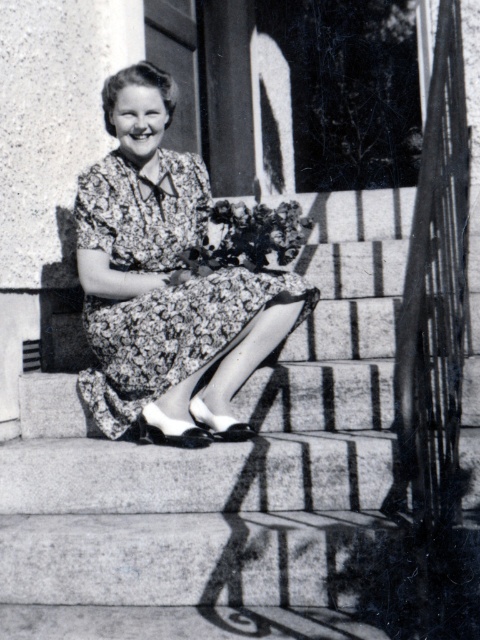
Question: Is smooth concrete stairs at center to the left of floral dress at center from the viewer's perspective?

Choices:
 (A) yes
 (B) no

Answer: (B)

Question: Does smooth concrete stairs at center appear over floral dress at center?

Choices:
 (A) yes
 (B) no

Answer: (B)

Question: Can you confirm if smooth concrete stairs at center is positioned below floral dress at center?

Choices:
 (A) yes
 (B) no

Answer: (A)